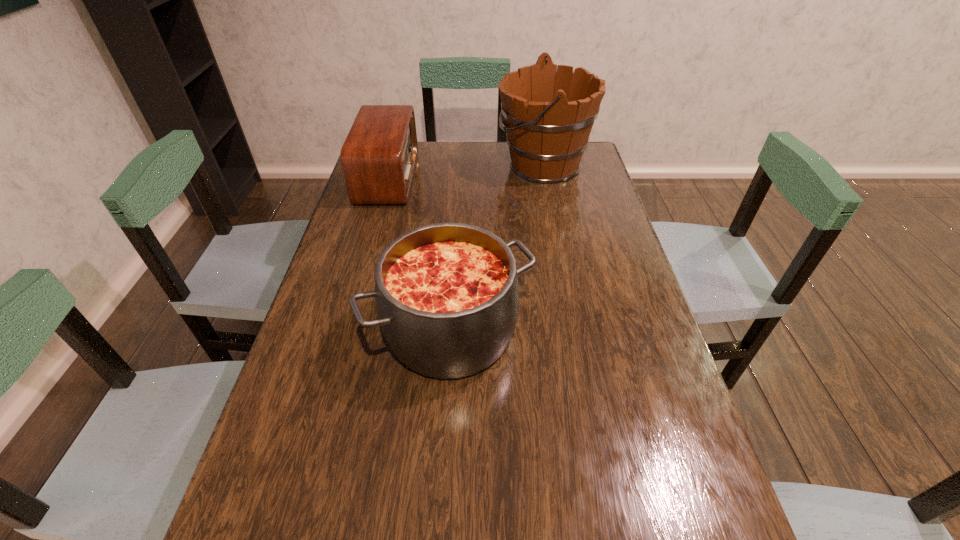
Image resolution: width=960 pixels, height=540 pixels. Find the location of `the tallest object`. the tallest object is located at coordinates (549, 115).

You are a GUI agent. You are given a task and a screenshot of the screen. Output one action in this format:
    pyautogui.click(x=<x>, y=<y>)
    Task: Click on the casserole
    
    Given the screenshot: What is the action you would take?
    pyautogui.click(x=447, y=294)

Find the location of a particular element. radio receiver is located at coordinates (378, 158).

This screenshot has width=960, height=540. I want to click on vacant area situated with the handle on the tallest object, so click(x=457, y=165).

Identify the location of vacant space located with the handle on the tallest object. (470, 165).

What are the coordinates of `free space located 0.380m with the handle on the tallest object` in the screenshot? It's located at (390, 165).

I want to click on vacant point located 0.140m on the right of the nearest object, so click(x=592, y=331).

Locate an element on the screen. vacant space situated on the front panel of the radio receiver is located at coordinates (431, 178).

Where is `wine bucket that is positioned at the far edge`? The image size is (960, 540). wine bucket that is positioned at the far edge is located at coordinates (549, 115).

The width and height of the screenshot is (960, 540). Find the location of `radio receiver at the far edge`. radio receiver at the far edge is located at coordinates coord(378,158).